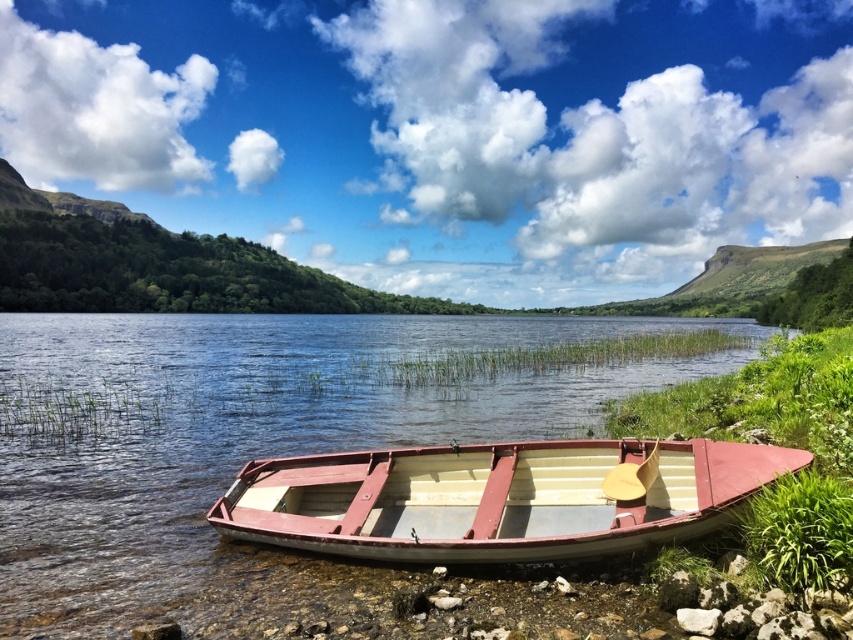
Question: Which object is closer to the camera taking this photo?

Choices:
 (A) white glossy water at center
 (B) white wooden boat at lower center

Answer: (A)

Question: Does white glossy water at center have a lesser width compared to white wooden boat at lower center?

Choices:
 (A) yes
 (B) no

Answer: (B)

Question: Can you confirm if white glossy water at center is positioned to the right of white wooden boat at lower center?

Choices:
 (A) no
 (B) yes

Answer: (A)

Question: From the image, what is the correct spatial relationship of white glossy water at center in relation to white wooden boat at lower center?

Choices:
 (A) below
 (B) above

Answer: (B)